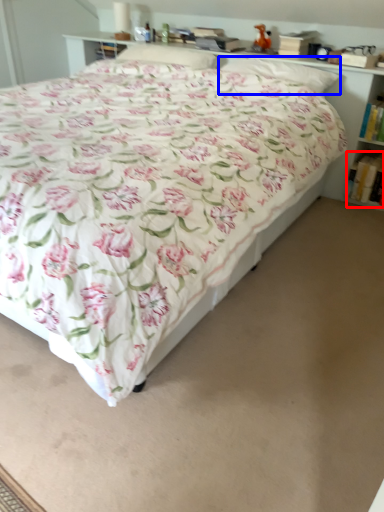
Question: Which object appears closest to the camera in this image, book (highlighted by a red box) or pillow (highlighted by a blue box)?

Choices:
 (A) book
 (B) pillow

Answer: (B)